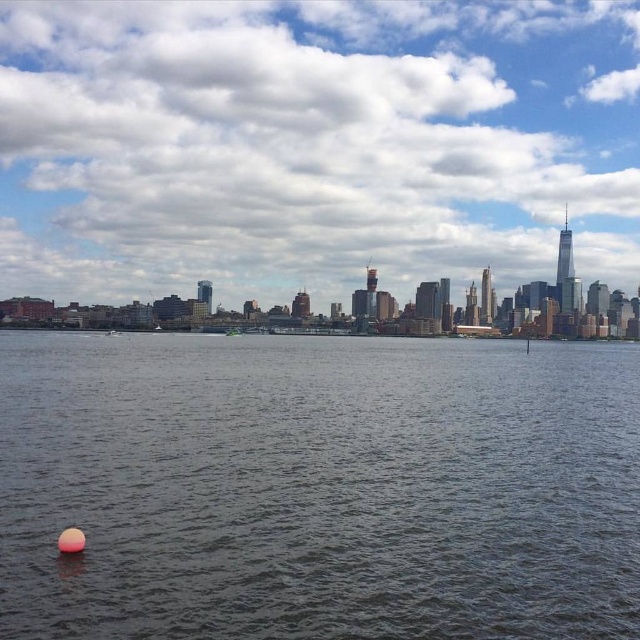
Question: Can you confirm if blue sky at upper center is bigger than green plastic boat at center?

Choices:
 (A) no
 (B) yes

Answer: (B)

Question: Is blue sky at upper center above green plastic boat at center?

Choices:
 (A) yes
 (B) no

Answer: (A)

Question: Which point is closer to the camera?

Choices:
 (A) blue sky at upper center
 (B) green plastic boat at center
 (C) dark gray water at lower left

Answer: (C)

Question: Which is farther from the dark gray water at lower left?

Choices:
 (A) blue sky at upper center
 (B) green plastic boat at center

Answer: (A)

Question: Which point is closer to the camera?

Choices:
 (A) dark gray water at lower left
 (B) green plastic boat at center
 (C) blue sky at upper center

Answer: (A)

Question: Is dark gray water at lower left to the right of blue sky at upper center from the viewer's perspective?

Choices:
 (A) no
 (B) yes

Answer: (B)